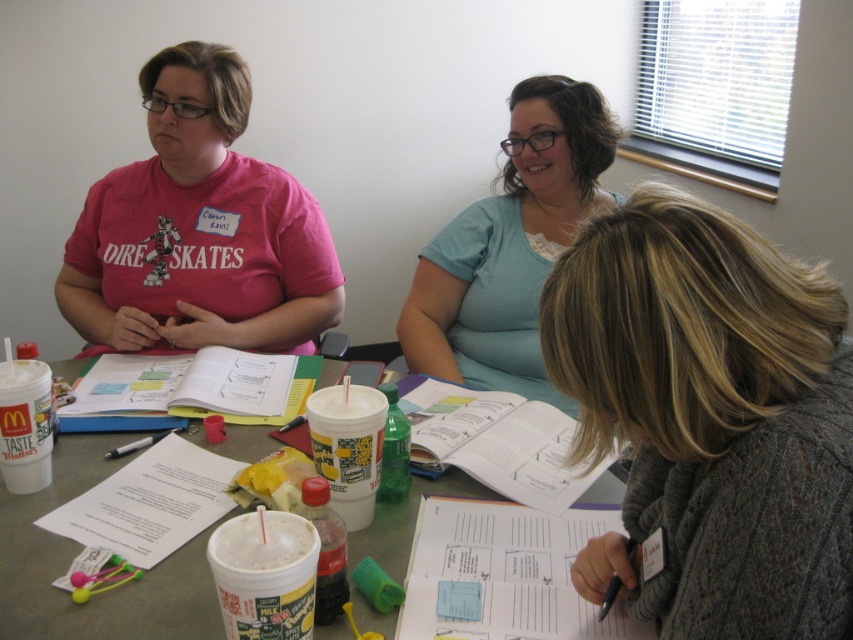
Question: Considering the relative positions of pink matte shirt at upper left and white paper at center in the image provided, where is pink matte shirt at upper left located with respect to white paper at center?

Choices:
 (A) above
 (B) below

Answer: (A)

Question: Can you confirm if knitted gray sweater at lower right is positioned above white paper at center?

Choices:
 (A) no
 (B) yes

Answer: (B)

Question: Can you confirm if knitted gray sweater at lower right is thinner than pink matte shirt at upper left?

Choices:
 (A) no
 (B) yes

Answer: (B)

Question: Based on their relative distances, which object is nearer to the knitted gray sweater at lower right?

Choices:
 (A) light blue fabric shirt at upper center
 (B) white paper at center
 (C) pink matte shirt at upper left

Answer: (B)

Question: Which point is farther to the camera?

Choices:
 (A) pink matte shirt at upper left
 (B) white paper at center
 (C) knitted gray sweater at lower right

Answer: (A)

Question: Which object is farther from the camera taking this photo?

Choices:
 (A) light blue fabric shirt at upper center
 (B) knitted gray sweater at lower right
 (C) pink matte shirt at upper left
 (D) white paper at center

Answer: (A)